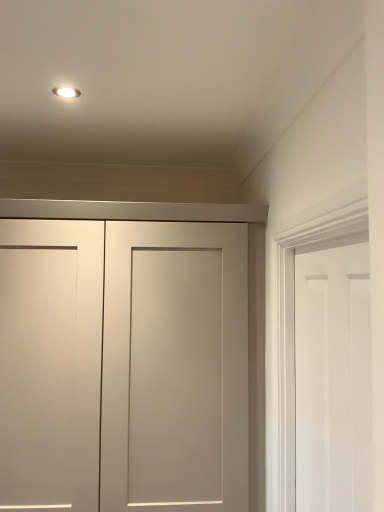
Locate an element on the screen. The width and height of the screenshot is (384, 512). white matte door at right, acting as the first door starting from the right is located at coordinates (333, 379).

This screenshot has height=512, width=384. Describe the element at coordinates (333, 379) in the screenshot. I see `white matte door at right, which appears as the 2th door when viewed from the left` at that location.

Describe the element at coordinates (123, 365) in the screenshot. I see `matte white cabinet at center, the 1th door when ordered from back to front` at that location.

What are the coordinates of `matte white cabinet at center, placed as the 1th door when sorted from left to right` in the screenshot? It's located at (123, 365).

I want to click on white matte door at right, acting as the first door starting from the right, so click(x=333, y=379).

Is matte white cabinet at center, arranged as the 2th door when viewed from the right, at the right side of white matte door at right, the 1th door when ordered from front to back?

No.

Which object is further away from the camera, matte white cabinet at center, placed as the 1th door when sorted from left to right, or white matte door at right, the 1th door when ordered from front to back?

matte white cabinet at center, placed as the 1th door when sorted from left to right, is behind.

Based on the photo, which is nearer, (62, 322) or (351, 367)?

Point (62, 322).

From the image's perspective, is matte white cabinet at center, marked as the 2th door in a front-to-back arrangement, on top of white matte door at right, which appears as the 2th door when viewed from the left?

Actually, matte white cabinet at center, marked as the 2th door in a front-to-back arrangement, appears below white matte door at right, which appears as the 2th door when viewed from the left, in the image.

From a real-world perspective, is matte white cabinet at center, marked as the 2th door in a front-to-back arrangement, positioned above or below white matte door at right, acting as the first door starting from the right?

Clearly, from a real-world perspective, matte white cabinet at center, marked as the 2th door in a front-to-back arrangement, is below white matte door at right, acting as the first door starting from the right.

Looking at their sizes, would you say matte white cabinet at center, placed as the 1th door when sorted from left to right, is wider or thinner than white matte door at right, the 1th door when ordered from front to back?

In the image, matte white cabinet at center, placed as the 1th door when sorted from left to right, appears to be wider than white matte door at right, the 1th door when ordered from front to back.

Considering the sizes of objects matte white cabinet at center, placed as the 1th door when sorted from left to right, and white matte door at right, which appears as the 2th door when viewed from the left, in the image provided, who is shorter, matte white cabinet at center, placed as the 1th door when sorted from left to right, or white matte door at right, which appears as the 2th door when viewed from the left,?

white matte door at right, which appears as the 2th door when viewed from the left.

Consider the image. Can you confirm if matte white cabinet at center, arranged as the 2th door when viewed from the right, is bigger than white matte door at right, which appears as the 2th door when viewed from the left?

Correct, matte white cabinet at center, arranged as the 2th door when viewed from the right, is larger in size than white matte door at right, which appears as the 2th door when viewed from the left.

Does matte white cabinet at center, marked as the 2th door in a front-to-back arrangement, contain white matte door at right, acting as the first door starting from the right?

No, white matte door at right, acting as the first door starting from the right, is not inside matte white cabinet at center, marked as the 2th door in a front-to-back arrangement.

Is matte white cabinet at center, marked as the 2th door in a front-to-back arrangement, with white matte door at right, acting as the first door starting from the right?

matte white cabinet at center, marked as the 2th door in a front-to-back arrangement, and white matte door at right, acting as the first door starting from the right, are not in contact.

Is matte white cabinet at center, the 1th door when ordered from back to front, looking in the opposite direction of white matte door at right, the 1th door when ordered from front to back?

No, white matte door at right, the 1th door when ordered from front to back, is not at the back of matte white cabinet at center, the 1th door when ordered from back to front.

Can you tell me how much matte white cabinet at center, placed as the 1th door when sorted from left to right, and white matte door at right, marked as the 2th door in a back-to-front arrangement, differ in facing direction?

The angle between the facing direction of matte white cabinet at center, placed as the 1th door when sorted from left to right, and the facing direction of white matte door at right, marked as the 2th door in a back-to-front arrangement, is 89.6 degrees.

How much distance is there between matte white cabinet at center, marked as the 2th door in a front-to-back arrangement, and white matte door at right, acting as the first door starting from the right?

A distance of 26.94 inches exists between matte white cabinet at center, marked as the 2th door in a front-to-back arrangement, and white matte door at right, acting as the first door starting from the right.

In the image, there is a white matte door at right, acting as the first door starting from the right. Where is `door below it (from a real-world perspective)`? The image size is (384, 512). door below it (from a real-world perspective) is located at coordinates (123, 365).

Can you confirm if white matte door at right, marked as the 2th door in a back-to-front arrangement, is positioned to the left of matte white cabinet at center, the 1th door when ordered from back to front?

In fact, white matte door at right, marked as the 2th door in a back-to-front arrangement, is to the right of matte white cabinet at center, the 1th door when ordered from back to front.

Based on the photo, who is more distant, white matte door at right, the 1th door when ordered from front to back, or matte white cabinet at center, the 1th door when ordered from back to front?

matte white cabinet at center, the 1th door when ordered from back to front, is further from the camera.

Does point (304, 349) appear closer or farther from the camera than point (137, 509)?

Point (304, 349).

From the image's perspective, relative to matte white cabinet at center, placed as the 1th door when sorted from left to right, is white matte door at right, acting as the first door starting from the right, above or below?

white matte door at right, acting as the first door starting from the right, is situated higher than matte white cabinet at center, placed as the 1th door when sorted from left to right, in the image.

From a real-world perspective, is white matte door at right, which appears as the 2th door when viewed from the left, physically below matte white cabinet at center, arranged as the 2th door when viewed from the right?

Incorrect, from a real-world perspective, white matte door at right, which appears as the 2th door when viewed from the left, is higher than matte white cabinet at center, arranged as the 2th door when viewed from the right.

Can you confirm if white matte door at right, the 1th door when ordered from front to back, is thinner than matte white cabinet at center, placed as the 1th door when sorted from left to right?

Yes.

Which of these two, white matte door at right, which appears as the 2th door when viewed from the left, or matte white cabinet at center, the 1th door when ordered from back to front, stands taller?

matte white cabinet at center, the 1th door when ordered from back to front.

Considering the relative sizes of white matte door at right, which appears as the 2th door when viewed from the left, and matte white cabinet at center, arranged as the 2th door when viewed from the right, in the image provided, is white matte door at right, which appears as the 2th door when viewed from the left, bigger than matte white cabinet at center, arranged as the 2th door when viewed from the right,?

Actually, white matte door at right, which appears as the 2th door when viewed from the left, might be smaller than matte white cabinet at center, arranged as the 2th door when viewed from the right.

Is white matte door at right, which appears as the 2th door when viewed from the left, located outside matte white cabinet at center, marked as the 2th door in a front-to-back arrangement?

Absolutely, white matte door at right, which appears as the 2th door when viewed from the left, is external to matte white cabinet at center, marked as the 2th door in a front-to-back arrangement.

Is white matte door at right, acting as the first door starting from the right, not close to matte white cabinet at center, the 1th door when ordered from back to front?

No, white matte door at right, acting as the first door starting from the right, is in close proximity to matte white cabinet at center, the 1th door when ordered from back to front.

Is white matte door at right, which appears as the 2th door when viewed from the left, aimed at matte white cabinet at center, placed as the 1th door when sorted from left to right?

No, white matte door at right, which appears as the 2th door when viewed from the left, is not facing towards matte white cabinet at center, placed as the 1th door when sorted from left to right.

From the picture: Measure the distance from white matte door at right, acting as the first door starting from the right, to matte white cabinet at center, arranged as the 2th door when viewed from the right.

white matte door at right, acting as the first door starting from the right, and matte white cabinet at center, arranged as the 2th door when viewed from the right, are 68.42 centimeters apart from each other.

The height and width of the screenshot is (512, 384). Find the location of `door on the left of white matte door at right, the 1th door when ordered from front to back`. door on the left of white matte door at right, the 1th door when ordered from front to back is located at coordinates (123, 365).

Locate an element on the screen. This screenshot has width=384, height=512. door lying in front of the matte white cabinet at center, the 1th door when ordered from back to front is located at coordinates (333, 379).

You are a GUI agent. You are given a task and a screenshot of the screen. Output one action in this format:
    pyautogui.click(x=<x>, y=<y>)
    Task: Click on the door behind the white matte door at right, the 1th door when ordered from front to back
    The width and height of the screenshot is (384, 512).
    Given the screenshot: What is the action you would take?
    pyautogui.click(x=123, y=365)